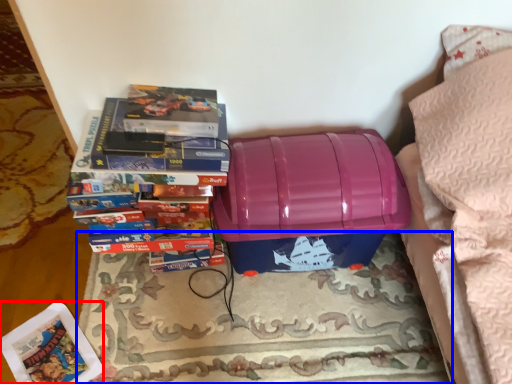
Question: Which of the following is the farthest to the observer, paperback book (highlighted by a red box) or mat (highlighted by a blue box)?

Choices:
 (A) paperback book
 (B) mat

Answer: (A)